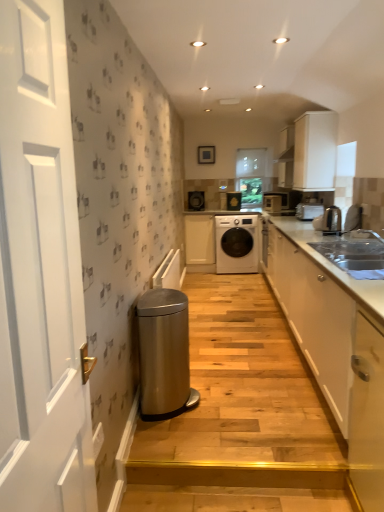
Find the location of a particular element. The height and width of the screenshot is (512, 384). wooden step at lower center, arranged as the 1th stairwell when viewed from the front is located at coordinates pos(235,487).

What do you see at coordinates (164, 354) in the screenshot? I see `satin silver water heater at lower left` at bounding box center [164, 354].

The image size is (384, 512). Describe the element at coordinates (251, 162) in the screenshot. I see `transparent glass window at center` at that location.

Locate an element on the screen. wooden step at lower center, which is counted as the 2th stairwell, starting from the back is located at coordinates (235, 487).

From the image's perspective, does metallic silver toaster at upper right, the fourth appliance positioned from the back, appear lower than satin metallic toaster at right, which is counted as the third appliance, starting from the right?

No, from the image's perspective, metallic silver toaster at upper right, the fourth appliance positioned from the back, is not beneath satin metallic toaster at right, which is counted as the third appliance, starting from the right.

From the picture: How many degrees apart are the facing directions of metallic silver toaster at upper right, the fourth appliance positioned from the back, and satin metallic toaster at right, the third appliance when ordered from left to right?

0.00425 degrees.

You are a GUI agent. You are given a task and a screenshot of the screen. Output one action in this format:
    pyautogui.click(x=<x>, y=<y>)
    Task: Click on the appliance that is below the metallic silver toaster at upper right, which is the first appliance from right to left (from the image's perspective)
    This screenshot has height=512, width=384.
    Given the screenshot: What is the action you would take?
    pyautogui.click(x=331, y=221)

Between point (311, 203) and point (327, 208), which one is positioned behind?

The point (311, 203) is farther.

Does white glossy cabinet at right, which is counted as the 3th cabinetry, starting from the left, have a lesser width compared to metallic microwave at upper right, which is the second appliance in right-to-left order?

Incorrect, the width of white glossy cabinet at right, which is counted as the 3th cabinetry, starting from the left, is not less than that of metallic microwave at upper right, which is the second appliance in right-to-left order.

Choose the correct answer: Is white glossy cabinet at right, the 2th cabinetry viewed from the front, inside metallic microwave at upper right, the fourth appliance positioned from the left, or outside it?

white glossy cabinet at right, the 2th cabinetry viewed from the front, lies outside metallic microwave at upper right, the fourth appliance positioned from the left.

Is white glossy cabinet at right, which is counted as the 3th cabinetry, starting from the left, in contact with metallic microwave at upper right, the third appliance positioned from the front?

No, white glossy cabinet at right, which is counted as the 3th cabinetry, starting from the left, is not beside metallic microwave at upper right, the third appliance positioned from the front.

Considering the positions of points (351, 234) and (156, 354), is point (351, 234) closer to camera compared to point (156, 354)?

No.

How different are the orientations of silver metallic sink at right and satin silver water heater at lower left in degrees?

They differ by 180 degrees in their facing directions.

From a real-world perspective, is silver metallic sink at right beneath satin silver water heater at lower left?

Incorrect, from a real-world perspective, silver metallic sink at right is higher than satin silver water heater at lower left.

Looking at this image, can you confirm if silver metallic sink at right is positioned to the right of satin silver water heater at lower left?

Correct, you'll find silver metallic sink at right to the right of satin silver water heater at lower left.

From a real-world perspective, does white matte cabinet at center, the fourth cabinetry when ordered from right to left, sit lower than white wooden door at left?

Correct, in the physical world, white matte cabinet at center, the fourth cabinetry when ordered from right to left, is lower than white wooden door at left.

Is point (199, 265) positioned in front of point (64, 49)?

No, (199, 265) is further to viewer.

Is white matte cabinet at center, the fourth cabinetry when ordered from right to left, at the left side of white wooden door at left?

No.

Consider the image. From the image's perspective, is black glossy washing machine at center, the 5th appliance when ordered from front to back, under satin silver water heater at lower left?

No, from the image's perspective, black glossy washing machine at center, the 5th appliance when ordered from front to back, is not beneath satin silver water heater at lower left.

Is point (233, 192) closer or farther from the camera than point (177, 360)?

Point (233, 192) appears to be farther away from the viewer than point (177, 360).

Is black glossy washing machine at center, which appears as the fourth appliance when viewed from the right, touching satin silver water heater at lower left?

No, black glossy washing machine at center, which appears as the fourth appliance when viewed from the right, is not with satin silver water heater at lower left.

Between white matte cabinet at center, the fourth cabinetry when ordered from right to left, and white glossy cabinet at right, the 3th cabinetry in the back-to-front sequence, which one has more height?

Standing taller between the two is white matte cabinet at center, the fourth cabinetry when ordered from right to left.

Is white matte cabinet at center, marked as the 1th cabinetry in a left-to-right arrangement, wider or thinner than white glossy cabinet at right, which is counted as the 3th cabinetry, starting from the left?

Considering their sizes, white matte cabinet at center, marked as the 1th cabinetry in a left-to-right arrangement, looks slimmer than white glossy cabinet at right, which is counted as the 3th cabinetry, starting from the left.

Is white matte cabinet at center, the fourth cabinetry when ordered from right to left, far from white glossy cabinet at right, the 3th cabinetry in the back-to-front sequence?

Yes.

Could white glossy cabinet at right, the 2th cabinetry viewed from the front, be considered to be inside white matte cabinet at center, the fourth cabinetry when ordered from right to left?

No, white glossy cabinet at right, the 2th cabinetry viewed from the front, is located outside of white matte cabinet at center, the fourth cabinetry when ordered from right to left.

Does satin metallic toaster at right, the third appliance when ordered from left to right, have a lesser width compared to stainless steel trash can at lower left, which ranks as the second stairwell in front-to-back order?

Yes, satin metallic toaster at right, the third appliance when ordered from left to right, is thinner than stainless steel trash can at lower left, which ranks as the second stairwell in front-to-back order.

Between satin metallic toaster at right, which is counted as the third appliance, starting from the right, and stainless steel trash can at lower left, the second stairwell from the bottom, which one has larger size?

stainless steel trash can at lower left, the second stairwell from the bottom.

Can we say satin metallic toaster at right, which is counted as the third appliance, starting from the right, lies outside stainless steel trash can at lower left, the second stairwell from the bottom?

Yes, satin metallic toaster at right, which is counted as the third appliance, starting from the right, is outside of stainless steel trash can at lower left, the second stairwell from the bottom.

From a real-world perspective, which appliance is the 2nd one underneath the satin metallic toaster at right, which is counted as the third appliance, starting from the right? Please provide its 2D coordinates.

[(309, 210)]

Find the location of a particular element. cabinetry that is the 1st one when counting leftward from the metallic microwave at upper right, which is the second appliance in right-to-left order is located at coordinates point(336,344).

From the image, which object appears to be farther from satin silver water heater at lower left, matte black speaker at center, which is the 5th appliance in right-to-left order, or white glossy cabinet at right, the 2th cabinetry viewed from the front?

Based on the image, matte black speaker at center, which is the 5th appliance in right-to-left order, appears to be further to satin silver water heater at lower left.

Estimate the real-world distances between objects in this image. Which object is further from white glossy cabinet at right, the 2th cabinetry viewed from the front, wooden step at lower center, which is counted as the 2th stairwell, starting from the back, or silver metallic sink at right?

wooden step at lower center, which is counted as the 2th stairwell, starting from the back.

Looking at this image, estimate the real-world distances between objects in this image. Which object is closer to stainless steel trash can at lower left, marked as the 1th stairwell in a back-to-front arrangement, metallic silver toaster at upper right, the fourth appliance positioned from the back, or satin metallic toaster at right, the fifth appliance in the back-to-front sequence?

Among the two, satin metallic toaster at right, the fifth appliance in the back-to-front sequence, is located nearer to stainless steel trash can at lower left, marked as the 1th stairwell in a back-to-front arrangement.

Considering their positions, is satin silver water heater at lower left positioned further to wooden step at lower center, the 2th stairwell positioned from the top, than white matte cabinet at center, marked as the 1th cabinetry in a left-to-right arrangement?

white matte cabinet at center, marked as the 1th cabinetry in a left-to-right arrangement, is further to wooden step at lower center, the 2th stairwell positioned from the top.

When comparing their distances from white matte cabinet at upper right, the 3th cabinetry positioned from the front, does white glossy cabinet at lower right, which is counted as the first cabinetry, starting from the front, or wooden step at lower center, arranged as the first stairwell when ordered from the bottom, seem further?

Based on the image, wooden step at lower center, arranged as the first stairwell when ordered from the bottom, appears to be further to white matte cabinet at upper right, the 3th cabinetry positioned from the front.

Which object lies further to the anchor point transparent glass window at center, satin silver water heater at lower left or white wooden door at left?

white wooden door at left lies further to transparent glass window at center than the other object.

Which object lies nearer to the anchor point stainless steel trash can at lower left, the second stairwell from the bottom, satin silver water heater at lower left or matte black speaker at center, which appears as the 2th appliance when viewed from the back?

satin silver water heater at lower left lies closer to stainless steel trash can at lower left, the second stairwell from the bottom, than the other object.

Estimate the real-world distances between objects in this image. Which object is further from satin silver water heater at lower left, black glossy washing machine at center, the 2th appliance from the left, or white wooden door at left?

black glossy washing machine at center, the 2th appliance from the left, is further to satin silver water heater at lower left.

Where is `sink between white glossy cabinet at right, the 2th cabinetry viewed from the front, and transparent glass window at center in the front-back direction`? The width and height of the screenshot is (384, 512). sink between white glossy cabinet at right, the 2th cabinetry viewed from the front, and transparent glass window at center in the front-back direction is located at coordinates (355, 254).

Identify the location of water heater between white wooden door at left and black glossy washing machine at center, the 5th appliance when ordered from front to back, from front to back. (164, 354).

The height and width of the screenshot is (512, 384). Identify the location of water heater between wooden step at lower center, arranged as the first stairwell when ordered from the bottom, and metallic silver toaster at upper right, which is counted as the fifth appliance, starting from the left, along the z-axis. (164, 354).

This screenshot has height=512, width=384. Identify the location of washing machine between stainless steel trash can at lower left, acting as the first stairwell starting from the top, and matte black speaker at center, the 4th appliance in the front-to-back sequence, along the z-axis. (236, 243).